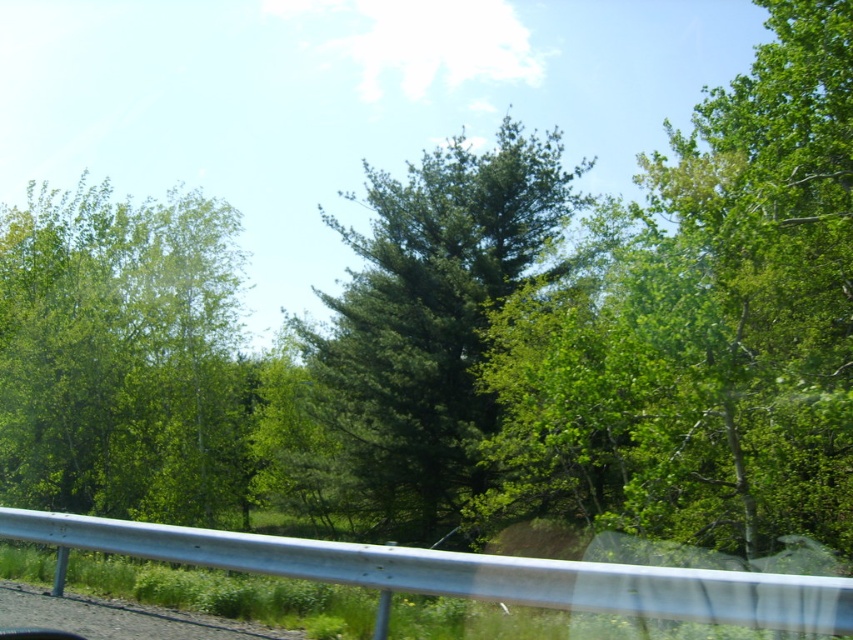
Question: Is green leafy tree at left positioned behind green matte tree at center?

Choices:
 (A) yes
 (B) no

Answer: (B)

Question: Which object appears closest to the camera in this image?

Choices:
 (A) green leafy tree at center
 (B) green matte tree at center

Answer: (A)

Question: Among these objects, which one is farthest from the camera?

Choices:
 (A) green leafy tree at left
 (B) green leafy tree at center

Answer: (A)

Question: Which of the following is the closest to the observer?

Choices:
 (A) (415, 348)
 (B) (227, 396)
 (C) (606, 472)

Answer: (C)

Question: Is green leafy tree at center behind green matte tree at center?

Choices:
 (A) no
 (B) yes

Answer: (A)

Question: Can you confirm if green leafy tree at center is smaller than green matte tree at center?

Choices:
 (A) no
 (B) yes

Answer: (A)